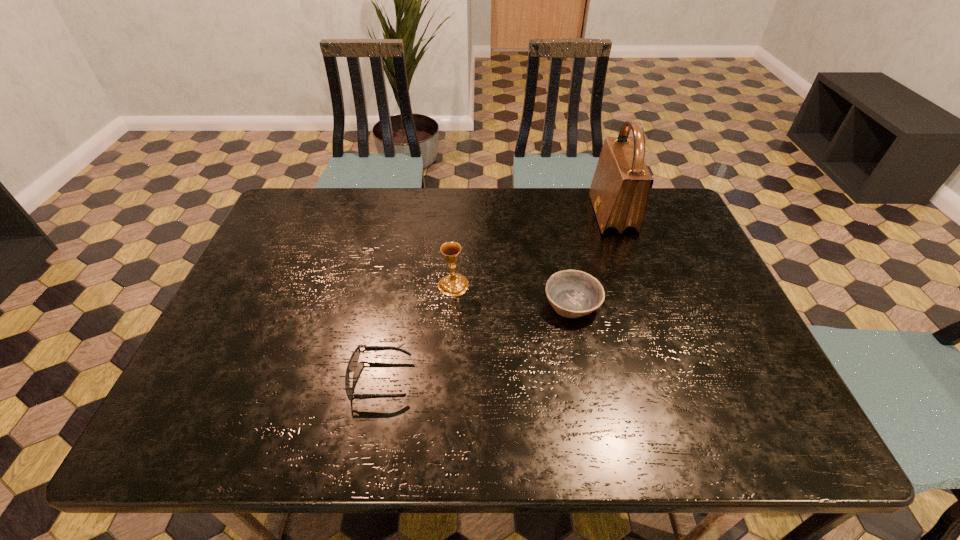
The height and width of the screenshot is (540, 960). Find the location of `blank space at the far left corner of the desktop`. blank space at the far left corner of the desktop is located at coordinates (294, 202).

In order to click on free area in between the chalice and the leftmost object in this screenshot , I will do `click(417, 332)`.

Where is `free space between the leftmost object and the farthest object`? Image resolution: width=960 pixels, height=540 pixels. free space between the leftmost object and the farthest object is located at coordinates (496, 297).

Identify the location of vacant point located between the third shortest object and the nearest object. (417, 332).

This screenshot has width=960, height=540. Find the location of `empty space between the bowl and the tallest object`. empty space between the bowl and the tallest object is located at coordinates (592, 259).

Locate an element on the screen. vacant area between the second tallest object and the bowl is located at coordinates (513, 294).

At what (x,y) coordinates should I click in order to perform the action: click on free space between the nearest object and the chalice. Please return your answer as a coordinate pair (x, y). The image size is (960, 540). Looking at the image, I should click on (417, 332).

Find the location of a particular element. vacant space that is in between the chalice and the bowl is located at coordinates (513, 294).

You are a GUI agent. You are given a task and a screenshot of the screen. Output one action in this format:
    pyautogui.click(x=<x>, y=<y>)
    Task: Click on the free point between the nearest object and the farthest object
    This screenshot has height=540, width=960.
    Given the screenshot: What is the action you would take?
    pyautogui.click(x=496, y=297)

You are a GUI agent. You are given a task and a screenshot of the screen. Output one action in this format:
    pyautogui.click(x=<x>, y=<y>)
    Task: Click on the vacant point located between the chalice and the shortest object
    This screenshot has width=960, height=540.
    Given the screenshot: What is the action you would take?
    pyautogui.click(x=417, y=332)